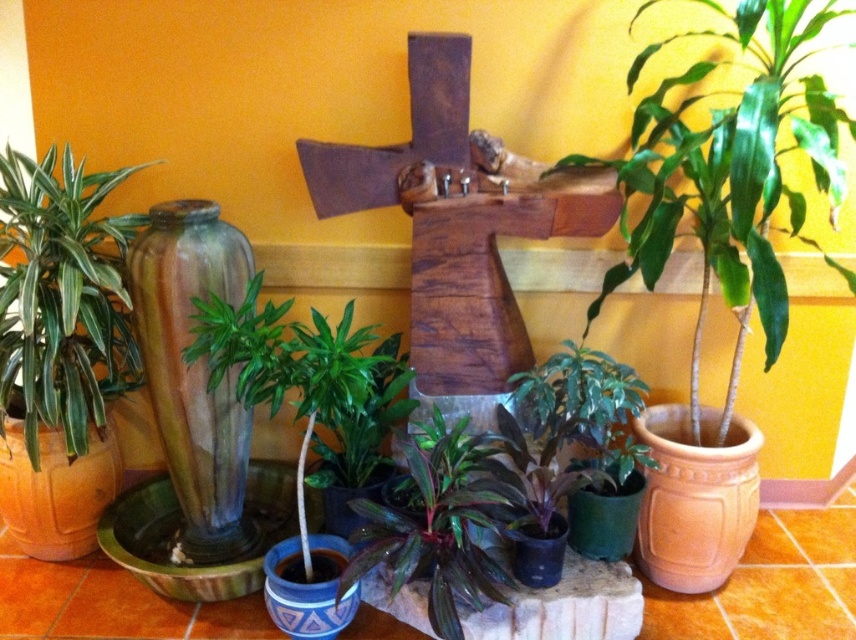
Is point (48, 294) behind point (382, 481)?

No, (48, 294) is closer to viewer.

Which of these two, green matte plant at left or blue glossy vase at center, stands shorter?

Standing shorter between the two is blue glossy vase at center.

Locate an element on the screen. The image size is (856, 640). green matte plant at left is located at coordinates (62, 298).

Is green matte plant at left behind purple glossy leaves at center?

Yes, it is behind purple glossy leaves at center.

Does green matte plant at left appear over purple glossy leaves at center?

Yes.

Is point (73, 456) closer to viewer compared to point (461, 563)?

That is False.

Locate an element on the screen. This screenshot has width=856, height=640. green matte plant at left is located at coordinates (62, 298).

Does matte glass vase at left lie in front of green matte vase at lower right?

No.

Between point (19, 458) and point (605, 547), which one is positioned in front?

Point (605, 547)

This screenshot has height=640, width=856. In order to click on matte glass vase at left in this screenshot , I will do `click(56, 490)`.